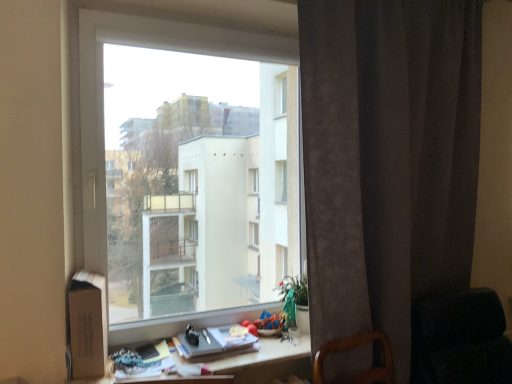
Question: Should I look upward or downward to see dark fabric rocking chair at lower right?

Choices:
 (A) down
 (B) up

Answer: (A)

Question: Is the surface of wooden desk at center in direct contact with dark gray velvet curtain at right?

Choices:
 (A) yes
 (B) no

Answer: (B)

Question: Can you confirm if wooden desk at center is positioned to the right of dark gray velvet curtain at right?

Choices:
 (A) no
 (B) yes

Answer: (A)

Question: Is wooden desk at center located outside dark gray velvet curtain at right?

Choices:
 (A) yes
 (B) no

Answer: (A)

Question: From a real-world perspective, is wooden desk at center physically below dark gray velvet curtain at right?

Choices:
 (A) yes
 (B) no

Answer: (A)

Question: From a real-world perspective, is wooden desk at center on dark gray velvet curtain at right?

Choices:
 (A) no
 (B) yes

Answer: (A)

Question: Is wooden desk at center smaller than dark gray velvet curtain at right?

Choices:
 (A) yes
 (B) no

Answer: (A)

Question: From the image's perspective, is matte gray book at lower center located above dark fabric rocking chair at lower right?

Choices:
 (A) no
 (B) yes

Answer: (B)

Question: Does matte gray book at lower center lie behind dark fabric rocking chair at lower right?

Choices:
 (A) no
 (B) yes

Answer: (B)

Question: Can you see matte gray book at lower center touching dark fabric rocking chair at lower right?

Choices:
 (A) yes
 (B) no

Answer: (B)

Question: Considering the relative sizes of matte gray book at lower center and dark fabric rocking chair at lower right in the image provided, is matte gray book at lower center wider than dark fabric rocking chair at lower right?

Choices:
 (A) yes
 (B) no

Answer: (B)

Question: From a real-world perspective, is matte gray book at lower center under dark fabric rocking chair at lower right?

Choices:
 (A) no
 (B) yes

Answer: (A)

Question: From a real-world perspective, is matte gray book at lower center over dark fabric rocking chair at lower right?

Choices:
 (A) yes
 (B) no

Answer: (A)

Question: From the image's perspective, does transparent glass window at center appear lower than dark gray velvet curtain at right?

Choices:
 (A) no
 (B) yes

Answer: (A)